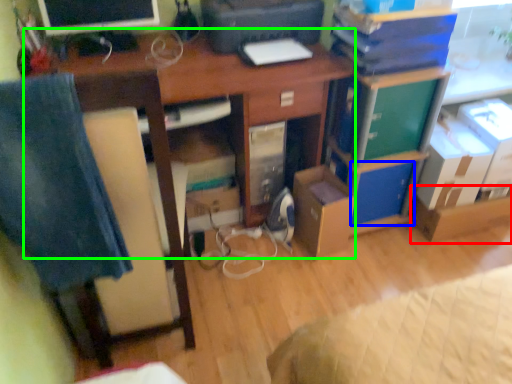
Question: Which object is the closest to the cardboard box (highlighted by a red box)? Choose among these: storage box (highlighted by a blue box) or desk (highlighted by a green box).

Choices:
 (A) storage box
 (B) desk

Answer: (A)